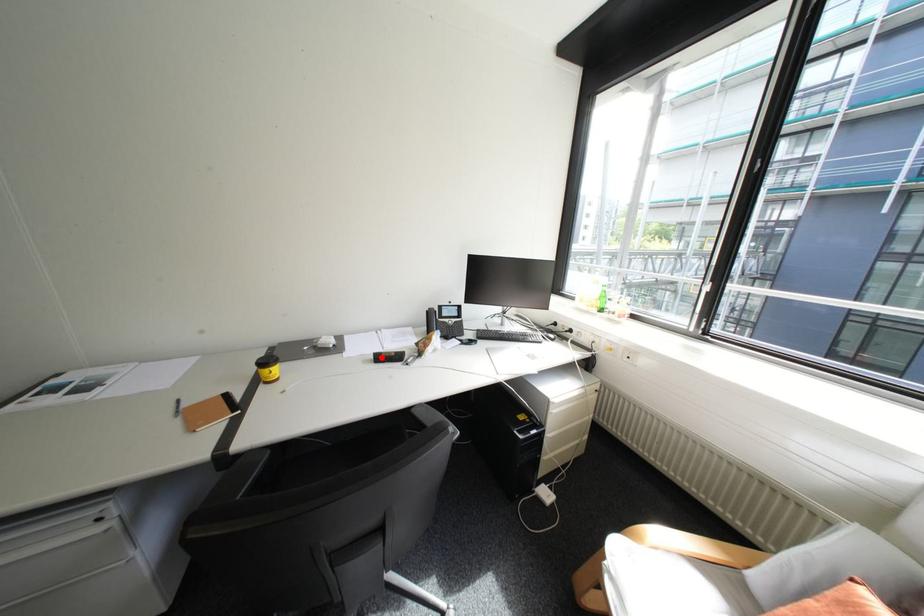
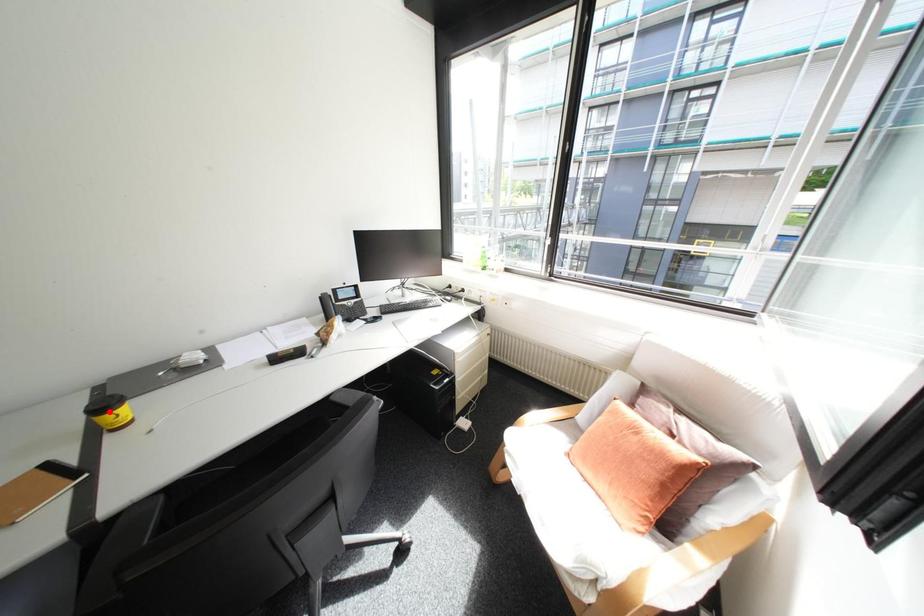
I am providing you with two images of the same scene from different viewpoints. A red point is marked on the first image and another point is marked on the second image. Does the point marked in image1 correspond to the same location as the one in image2?

No